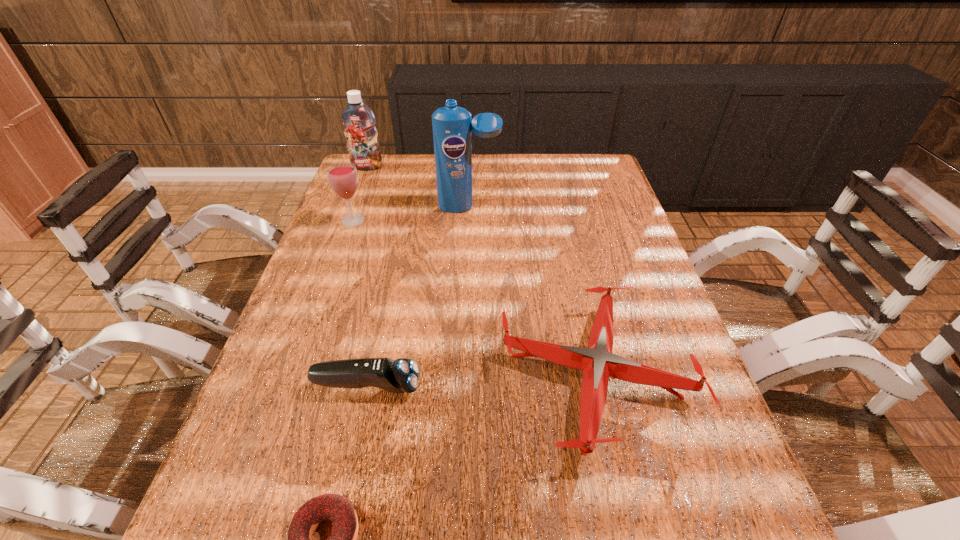
The width and height of the screenshot is (960, 540). Find the location of `vacant point at the right edge`. vacant point at the right edge is located at coordinates (643, 441).

Find the location of a particular element. This screenshot has height=540, width=960. free location at the far left corner is located at coordinates (363, 173).

In the image, there is a desktop. Where is `vacant space at the far right corner`? vacant space at the far right corner is located at coordinates (585, 153).

I want to click on unoccupied area between the wineglass and the electric shaver, so click(x=360, y=303).

You are a GUI agent. You are given a task and a screenshot of the screen. Output one action in this format:
    pyautogui.click(x=<x>, y=<y>)
    Task: Click on the vacant area that lies between the taller shampoo and the left shampoo
    This screenshot has width=960, height=540.
    Given the screenshot: What is the action you would take?
    pyautogui.click(x=418, y=187)

At what (x,y) coordinates should I click in order to perform the action: click on vacant space that's between the farther shampoo and the electric shaver. Please return your answer as a coordinate pair (x, y). Looking at the image, I should click on (367, 276).

Identify the location of vacant space that's between the second tallest object and the electric shaver. (367, 276).

Locate an element on the screen. This screenshot has height=540, width=960. vacant region between the right shampoo and the wineglass is located at coordinates (411, 214).

Where is `object that ranks as the fifth closest to the drone`? This screenshot has width=960, height=540. object that ranks as the fifth closest to the drone is located at coordinates (358, 120).

Select which object appears as the third closest to the farther shampoo. Please provide its 2D coordinates. Your answer should be formatted as a tuple, i.e. [(x, y)], where the tuple contains the x and y coordinates of a point satisfying the conditions above.

[(598, 363)]